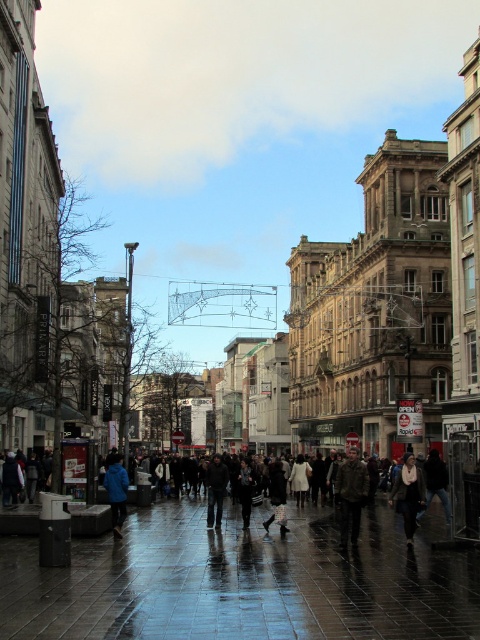
In the scene shown: Which is above, blue fabric jacket at center or dark gray jacket at center?

blue fabric jacket at center is higher up.

Which is below, blue fabric jacket at center or dark gray jacket at center?

dark gray jacket at center

Between point (120, 476) and point (446, 474), which one is positioned in front?

Point (120, 476) is more forward.

Where is `blue fabric jacket at center`? blue fabric jacket at center is located at coordinates (116, 490).

Does glossy tile pavement at center appear on the right side of white scarf at center?

No, glossy tile pavement at center is not to the right of white scarf at center.

Looking at this image, can you confirm if glossy tile pavement at center is taller than white scarf at center?

No, glossy tile pavement at center is not taller than white scarf at center.

Which is in front, point (301, 637) or point (421, 481)?

Positioned in front is point (301, 637).

Identify the location of glossy tile pavement at center. Image resolution: width=480 pixels, height=640 pixels. (240, 582).

Measure the distance between point (405, 529) and camera.

Point (405, 529) and camera are 64.62 meters apart from each other.

Where is `white scarf at center`? This screenshot has width=480, height=640. white scarf at center is located at coordinates (408, 493).

The width and height of the screenshot is (480, 640). In order to click on white scarf at center in this screenshot , I will do 408,493.